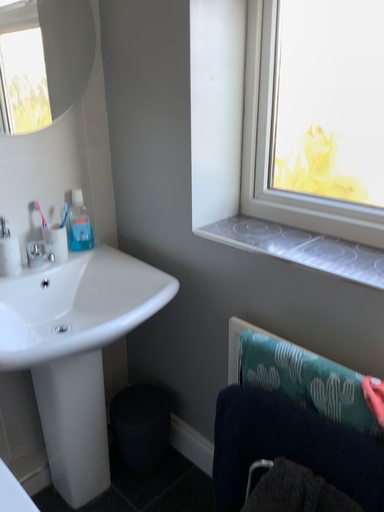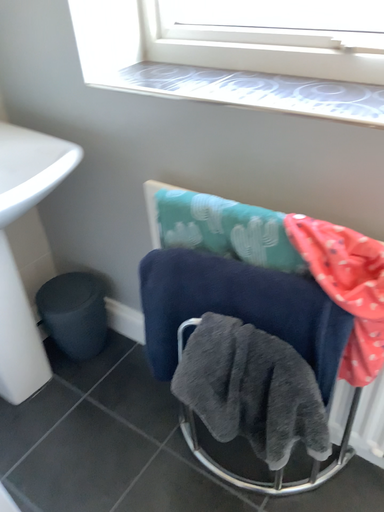
Question: Which way did the camera rotate in the video?

Choices:
 (A) rotated right
 (B) rotated left

Answer: (A)